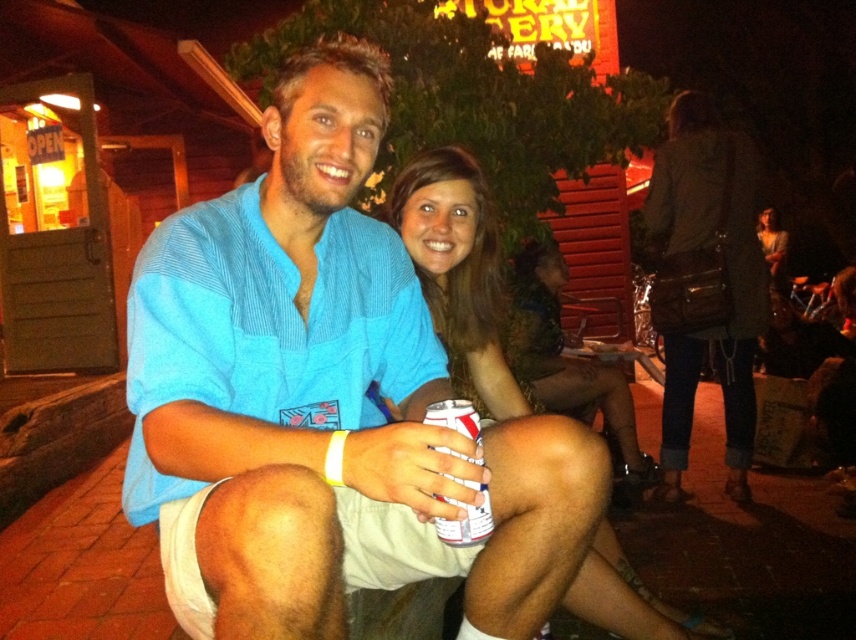
Question: Which object appears farthest from the camera in this image?

Choices:
 (A) white matte can at center
 (B) matte green dress at center
 (C) blue cotton shirt at center
 (D) leather jacket at right

Answer: (D)

Question: Which point is farther from the camera taking this photo?

Choices:
 (A) (678, 416)
 (B) (268, 324)
 (C) (449, 348)

Answer: (A)

Question: Is leather jacket at right bigger than matte green dress at center?

Choices:
 (A) no
 (B) yes

Answer: (B)

Question: Does blue cotton shirt at center have a lesser width compared to leather jacket at right?

Choices:
 (A) no
 (B) yes

Answer: (A)

Question: Considering the relative positions of blue cotton shirt at center and white matte can at center in the image provided, where is blue cotton shirt at center located with respect to white matte can at center?

Choices:
 (A) below
 (B) above

Answer: (B)

Question: Which of these objects is positioned closest to the matte green dress at center?

Choices:
 (A) blue cotton shirt at center
 (B) leather jacket at right
 (C) white matte can at center

Answer: (A)